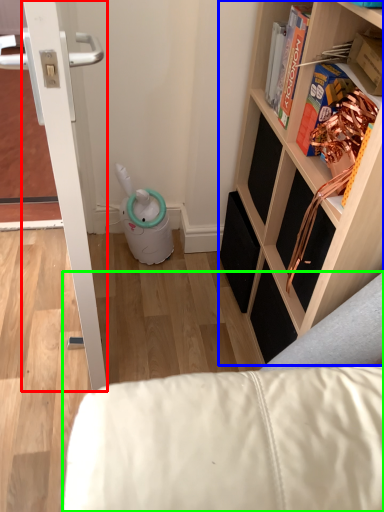
Question: Estimate the real-world distances between objects in this image. Which object is farther from door (highlighted by a red box), shelf (highlighted by a blue box) or furniture (highlighted by a green box)?

Choices:
 (A) shelf
 (B) furniture

Answer: (A)